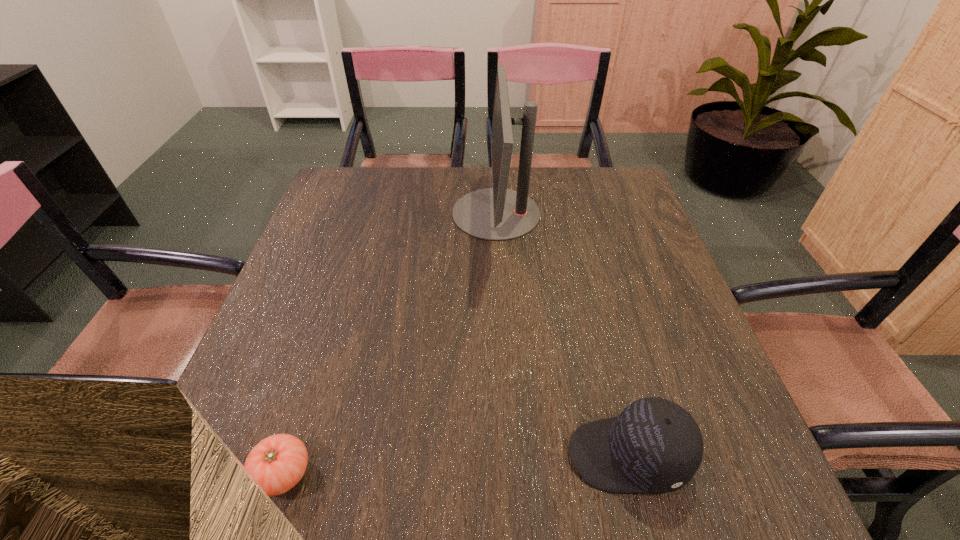
The image size is (960, 540). Find the location of `free spot between the farthest object and the second tallest object`. free spot between the farthest object and the second tallest object is located at coordinates (x=563, y=334).

Identify the location of free spot between the tallest object and the baseball cap. (x=563, y=334).

What are the coordinates of `vacant region between the tomato and the computer monitor` in the screenshot? It's located at (390, 343).

Identify the location of free area in between the tallest object and the leftmost object. (390, 343).

Where is `free space between the leftmost object and the farthest object`? free space between the leftmost object and the farthest object is located at coordinates (390, 343).

At what (x,y) coordinates should I click in order to perform the action: click on object that is the nearest to the leftmost object. Please return your answer as a coordinate pair (x, y). The image size is (960, 540). Looking at the image, I should click on (654, 445).

Identify which object is the second nearest to the shortest object. Please provide its 2D coordinates. Your answer should be formatted as a tuple, i.e. [(x, y)], where the tuple contains the x and y coordinates of a point satisfying the conditions above.

[(497, 214)]

Find the location of a particular element. The image size is (960, 540). vacant space that satisfies the following two spatial constraints: 1. at the front of the second shortest object where the brim is located; 2. on the front side of the shortest object is located at coordinates (634, 473).